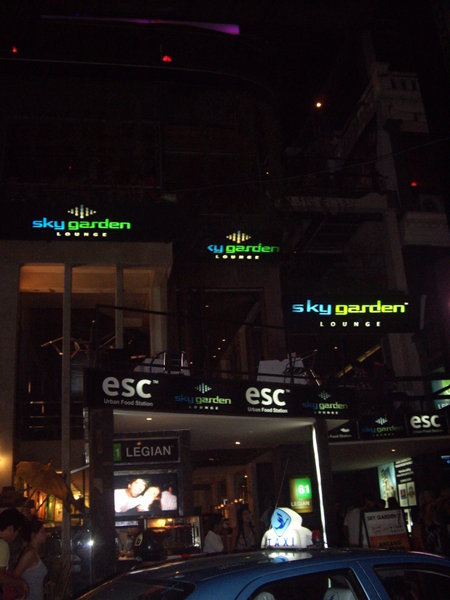
Identify the location of window2. The width and height of the screenshot is (450, 600). (340, 582).